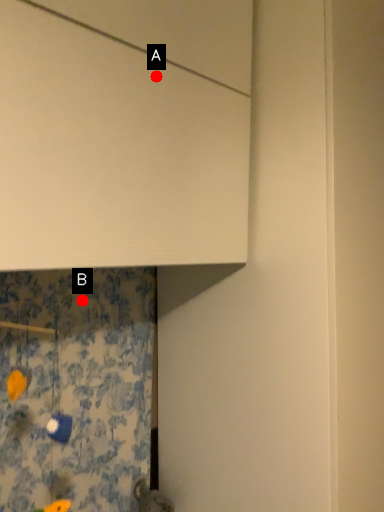
Question: Two points are circled on the image, labeled by A and B beside each circle. Which point is farther from the camera taking this photo?

Choices:
 (A) A is further
 (B) B is further

Answer: (B)